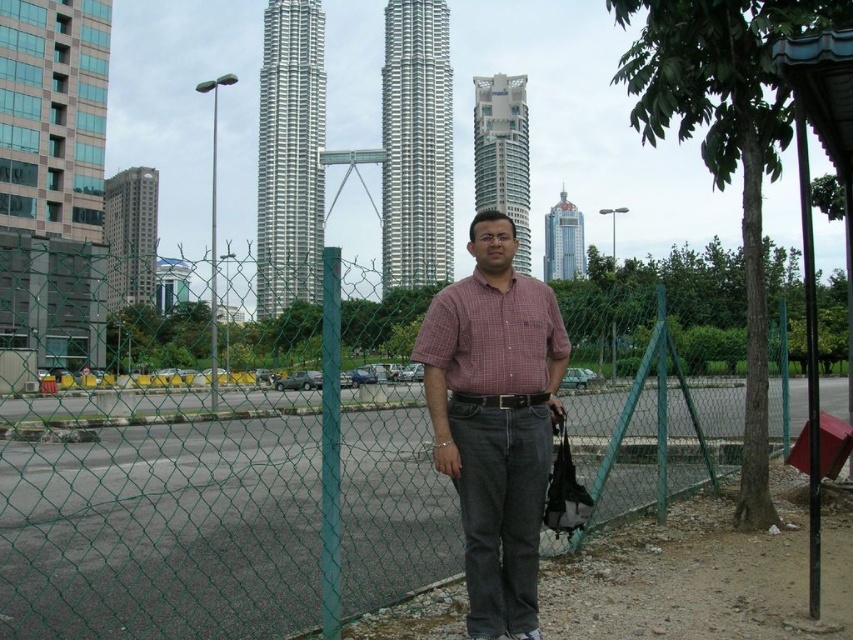
Which of these two, green chain-link fence at center or plaid cotton shirt at center, stands shorter?

plaid cotton shirt at center

Does green chain-link fence at center have a greater width compared to plaid cotton shirt at center?

Yes, green chain-link fence at center is wider than plaid cotton shirt at center.

What do you see at coordinates (222, 481) in the screenshot? The image size is (853, 640). I see `green chain-link fence at center` at bounding box center [222, 481].

At what (x,y) coordinates should I click in order to perform the action: click on green chain-link fence at center. Please return your answer as a coordinate pair (x, y). Looking at the image, I should click on (222, 481).

Does green chain-link fence at center have a smaller size compared to checkered fabric shirt at center?

Incorrect, green chain-link fence at center is not smaller in size than checkered fabric shirt at center.

Is point (38, 609) positioned after point (456, 310)?

No, it is in front of (456, 310).

Which is in front, point (631, 321) or point (459, 291)?

Point (459, 291) is in front.

The width and height of the screenshot is (853, 640). Find the location of `green chain-link fence at center`. green chain-link fence at center is located at coordinates (222, 481).

Is plaid cotton shirt at center thinner than checkered fabric shirt at center?

Yes.

Does point (440, 449) come farther from viewer compared to point (524, 394)?

No, it is in front of (524, 394).

Does point (543, 436) come farther from viewer compared to point (498, 380)?

Yes, it is.

This screenshot has width=853, height=640. In order to click on plaid cotton shirt at center in this screenshot , I will do `click(495, 420)`.